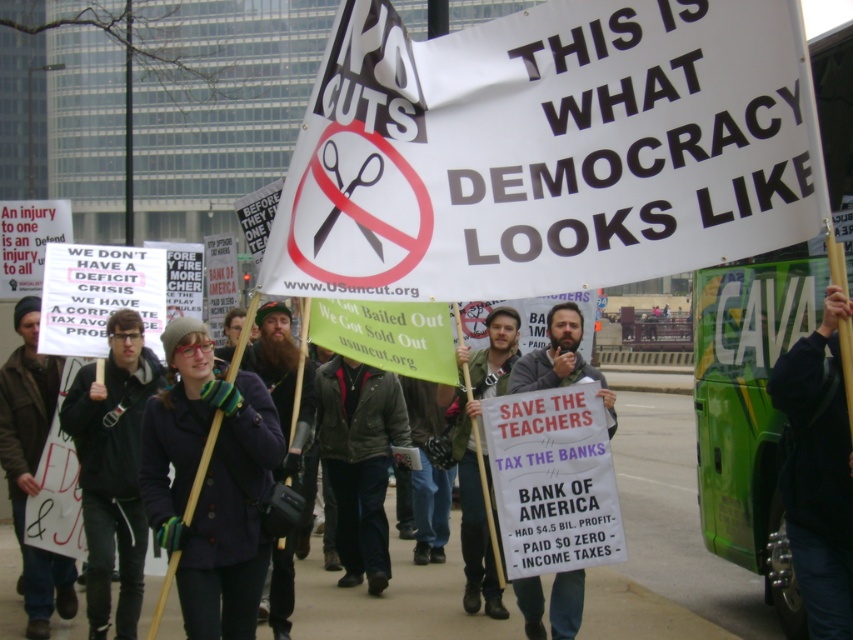
In the scene shown: Is dark blue woolen coat at center wider than bearded man at center?

Correct, the width of dark blue woolen coat at center exceeds that of bearded man at center.

Who is more forward, (186, 348) or (563, 618)?

Positioned in front is point (186, 348).

I want to click on dark blue woolen coat at center, so click(x=210, y=483).

Is black fabric at right wider than dark gray hoodie at center?

In fact, black fabric at right might be narrower than dark gray hoodie at center.

Between point (799, 484) and point (82, 428), which one is positioned behind?

The point (82, 428) is behind.

Who is more forward, (799, 484) or (131, 321)?

Point (799, 484) is in front.

What are the coordinates of `black fabric at right` in the screenshot? It's located at (817, 472).

Between black fabric at right and dark gray jacket at center, which one has more height?

dark gray jacket at center

In the scene shown: Who is more distant from viewer, (830, 442) or (381, 388)?

Positioned behind is point (381, 388).

The height and width of the screenshot is (640, 853). What do you see at coordinates (817, 472) in the screenshot?
I see `black fabric at right` at bounding box center [817, 472].

Identify the location of black fabric at right. (817, 472).